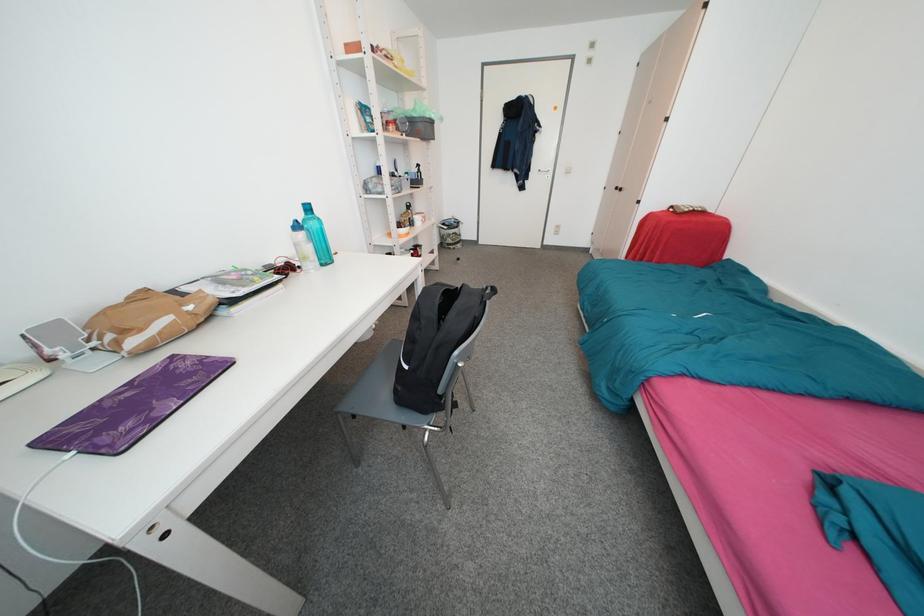
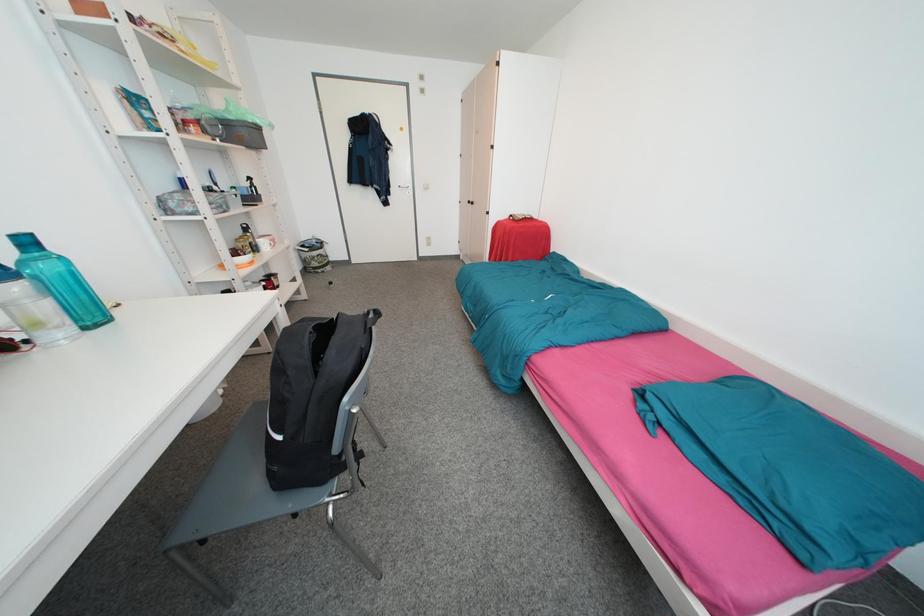
Question: How did the camera likely rotate?

Choices:
 (A) Left
 (B) Right
 (C) Up
 (D) Down

Answer: (B)